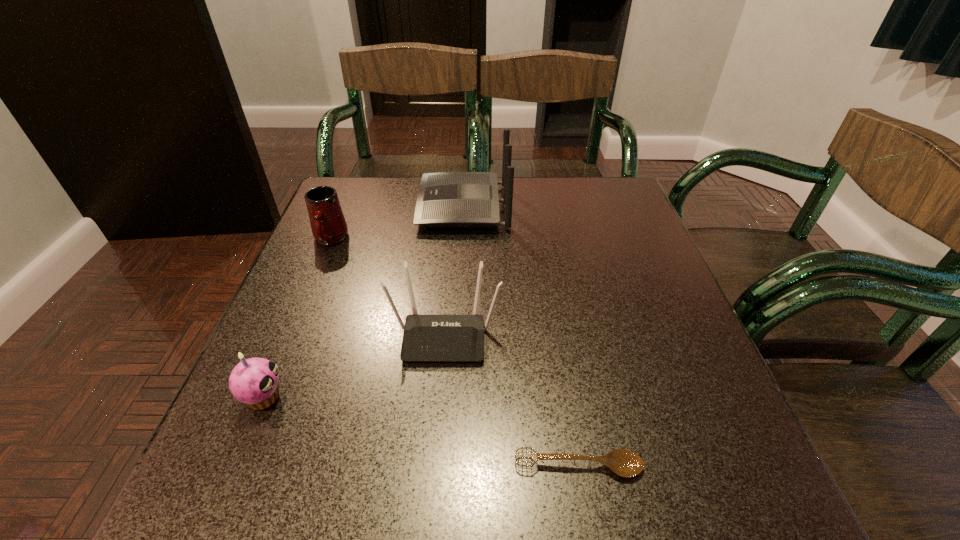
I want to click on vacant space that satisfies the following two spatial constraints: 1. on the front-facing side of the farther router; 2. on the front-facing side of the third farthest object, so click(x=458, y=335).

The image size is (960, 540). What are the coordinates of `free space that satisfies the following two spatial constraints: 1. on the front-facing side of the shorter router; 2. on the face of the cupcake` in the screenshot? It's located at (440, 397).

The width and height of the screenshot is (960, 540). In order to click on free space that satisfies the following two spatial constraints: 1. on the front-facing side of the nearer router; 2. on the right side of the nearest object in this screenshot , I will do `click(434, 466)`.

Where is `free spot that satisfies the following two spatial constraints: 1. on the side of the shortest object with the handle; 2. on the left side of the mug`? Image resolution: width=960 pixels, height=540 pixels. free spot that satisfies the following two spatial constraints: 1. on the side of the shortest object with the handle; 2. on the left side of the mug is located at coordinates (236, 466).

What are the coordinates of `vacant space that satisfies the following two spatial constraints: 1. on the side of the mug with the handle; 2. on the right side of the nearest object` in the screenshot? It's located at (236, 466).